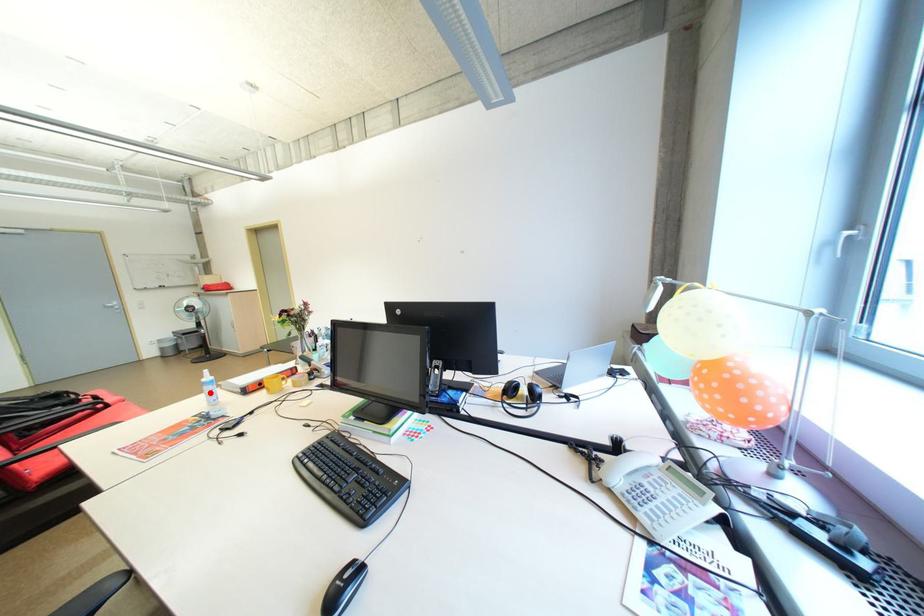
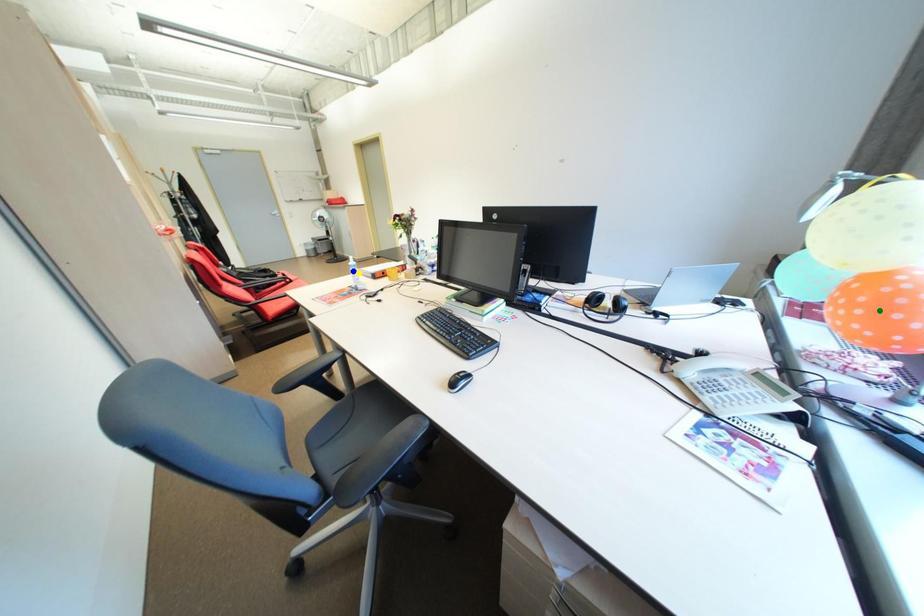
Question: I am providing you with two images of the same scene from different viewpoints. A red point is marked on the first image. You are given multiple points on the second image. In image 2, which mark is for the same physical point as the one in image 1?

Choices:
 (A) blue point
 (B) green point
 (C) yellow point

Answer: (C)